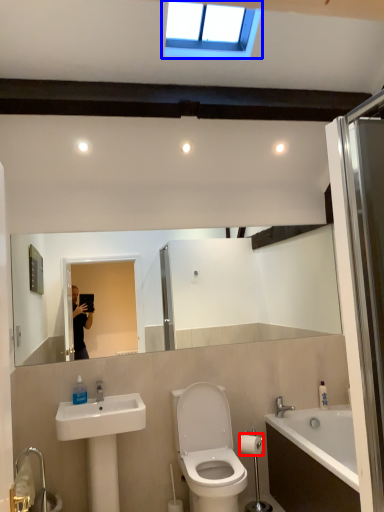
Question: Among these objects, which one is nearest to the camera, toilet paper (highlighted by a red box) or window (highlighted by a blue box)?

Choices:
 (A) toilet paper
 (B) window

Answer: (B)